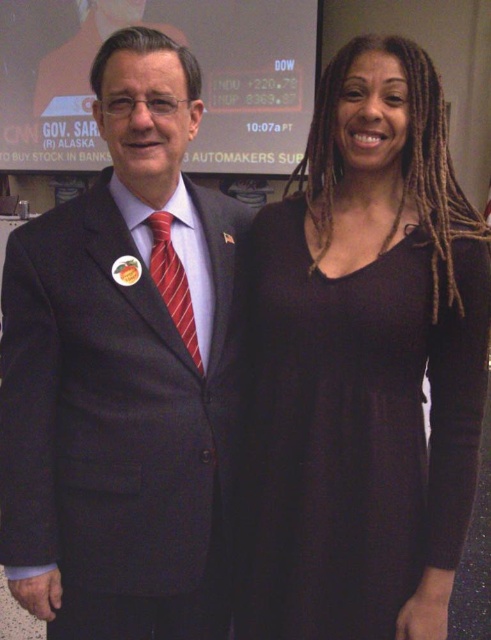
You are a photographer standing in the middle of the room. You want to take a photo of the dark matte dress at right and the matte black screen at upper center. Considering their distance, which object should you focus on first to ensure both are in frame?

The dark matte dress at right is closer to you than the matte black screen at upper center, so you should focus on the dark matte dress at right first to ensure both are in frame.

You are a photographer at a press conference. You need to take a photo of the matte black suit at center and the red striped tie at center. Which object will appear larger in the photo?

The matte black suit at center will appear larger in the photo because it is closer to the viewer than the red striped tie at center.